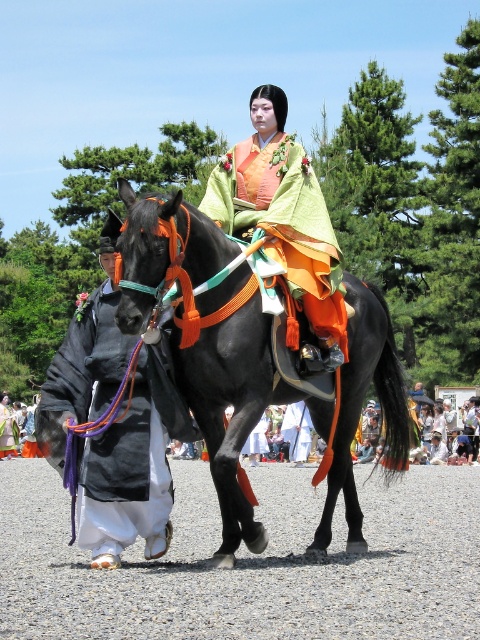
Question: Is black silk robe at left smaller than matte orange kimono at center?

Choices:
 (A) yes
 (B) no

Answer: (B)

Question: Among these objects, which one is nearest to the camera?

Choices:
 (A) shiny black horse at center
 (B) black silk robe at left
 (C) gray gravel at lower center

Answer: (C)

Question: Is shiny black horse at center bigger than matte orange kimono at center?

Choices:
 (A) yes
 (B) no

Answer: (B)

Question: Which of the following is the farthest from the observer?

Choices:
 (A) matte orange kimono at center
 (B) shiny black horse at center
 (C) black silk robe at left
 (D) gray gravel at lower center

Answer: (A)

Question: Which is farther from the matte orange kimono at center?

Choices:
 (A) shiny black horse at center
 (B) gray gravel at lower center
 (C) black silk robe at left

Answer: (B)

Question: Can you confirm if shiny black horse at center is positioned to the left of black silk robe at left?

Choices:
 (A) yes
 (B) no

Answer: (B)